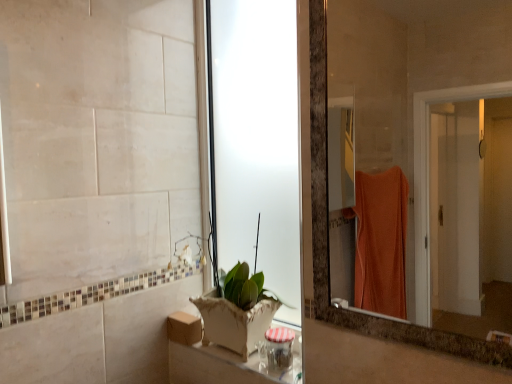
Question: Is white ceramic pot at lower center wider or thinner than transparent frosted glass door at center?

Choices:
 (A) thin
 (B) wide

Answer: (B)

Question: From the image's perspective, relative to transparent frosted glass door at center, is white ceramic pot at lower center above or below?

Choices:
 (A) above
 (B) below

Answer: (B)

Question: Based on their relative distances, which object is farther from the transparent frosted glass door at center?

Choices:
 (A) white ceramic pot at lower center
 (B) wooden box at lower center
 (C) matte glass mirror at right

Answer: (C)

Question: Which object is positioned farthest from the white ceramic pot at lower center?

Choices:
 (A) transparent frosted glass door at center
 (B) wooden box at lower center
 (C) matte glass mirror at right

Answer: (C)